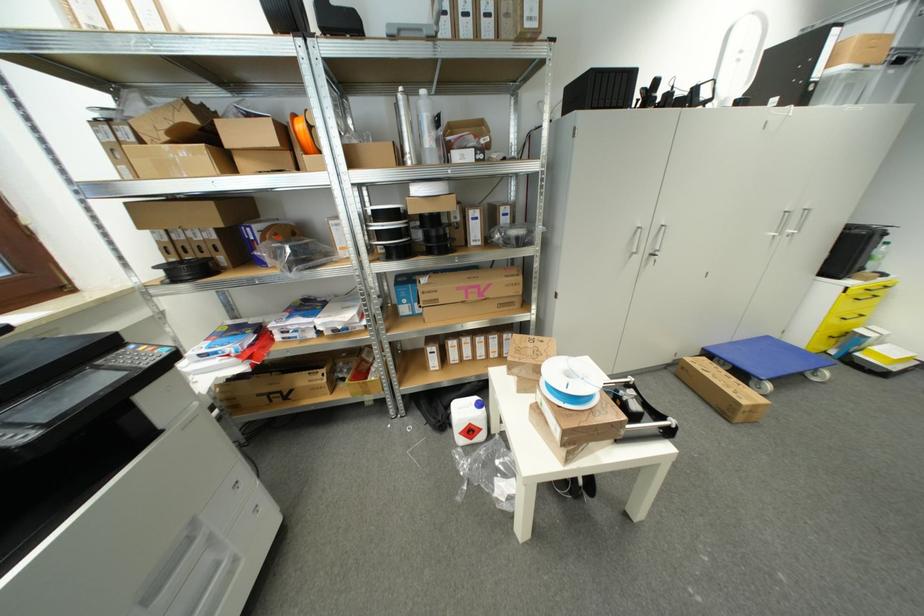
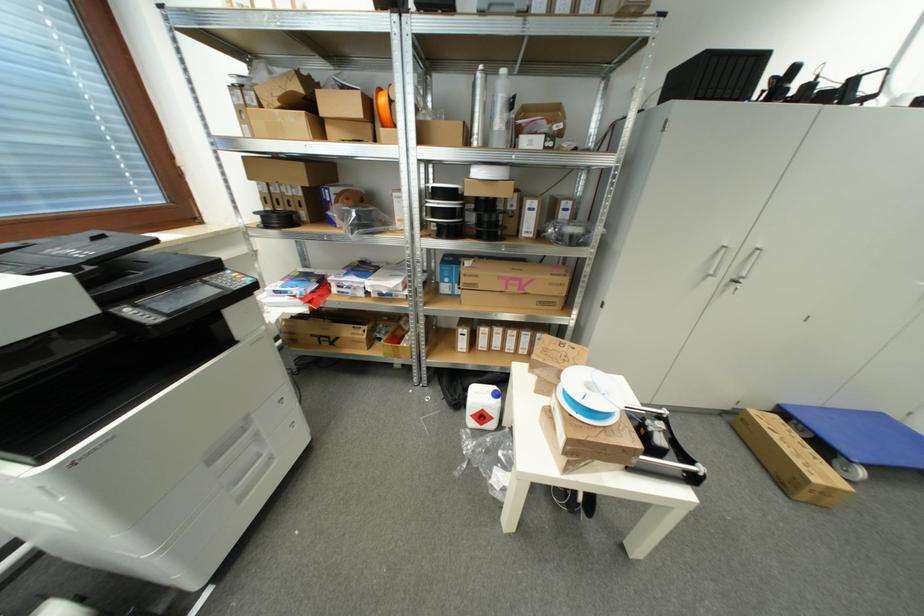
Question: Which direction would the cameraman need to move to produce the second image? Reply with the corresponding letter.

Choices:
 (A) Left
 (B) Right
 (C) Forward
 (D) Backward

Answer: (B)